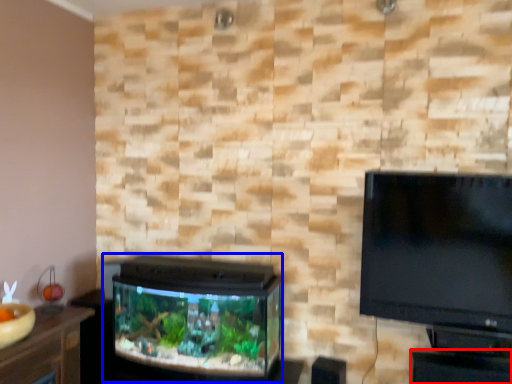
Question: Which of the following is the closest to the observer, table (highlighted by a red box) or tv cabinet (highlighted by a blue box)?

Choices:
 (A) table
 (B) tv cabinet

Answer: (A)